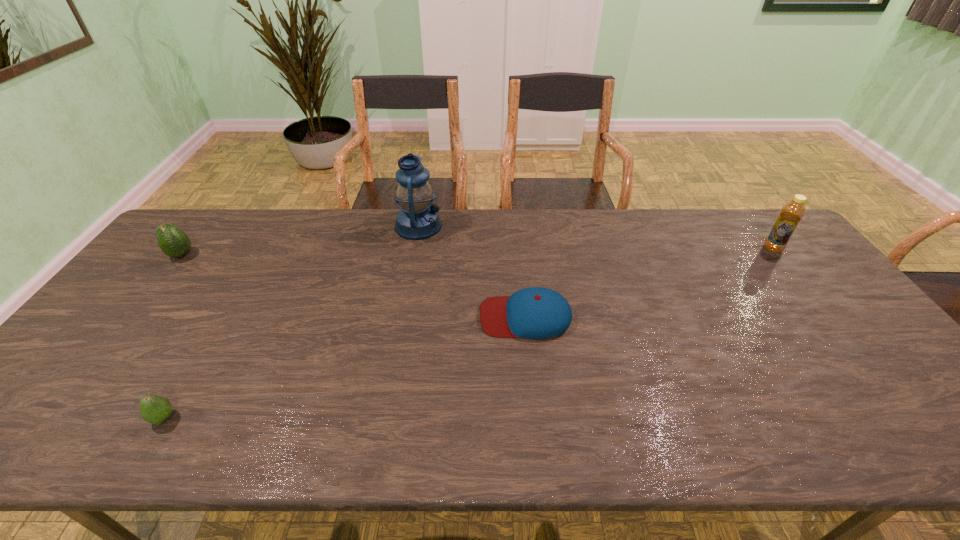
The image size is (960, 540). Find the location of `object located in the near edge section of the desktop`. object located in the near edge section of the desktop is located at coordinates (155, 409).

Identify the location of object present at the left edge. (172, 241).

At what (x,y) coordinates should I click in order to perform the action: click on object located in the right edge section of the desktop. Please return your answer as a coordinate pair (x, y). Looking at the image, I should click on (792, 212).

In order to click on object that is at the far left corner in this screenshot , I will do `click(172, 241)`.

Locate an element on the screen. This screenshot has height=540, width=960. object that is at the far right corner is located at coordinates tap(792, 212).

At what (x,y) coordinates should I click in order to perform the action: click on vacant point at the far edge. Please return your answer as a coordinate pair (x, y). Looking at the image, I should click on (391, 229).

The height and width of the screenshot is (540, 960). I want to click on free space at the near edge, so click(x=451, y=447).

Find the location of `vacant space at the left edge of the desktop`. vacant space at the left edge of the desktop is located at coordinates (80, 414).

Image resolution: width=960 pixels, height=540 pixels. What are the coordinates of `free point at the right edge` in the screenshot? It's located at (805, 303).

Where is `unoccupied position between the tallest object and the fourth object from left to right`? This screenshot has height=540, width=960. unoccupied position between the tallest object and the fourth object from left to right is located at coordinates (472, 271).